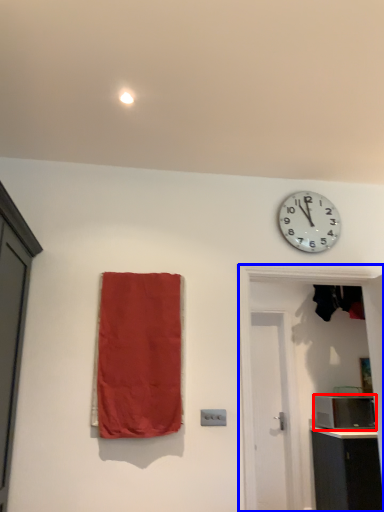
Question: Which point is closer to the camera, appliance (highlighted by a red box) or door (highlighted by a blue box)?

Choices:
 (A) appliance
 (B) door

Answer: (B)